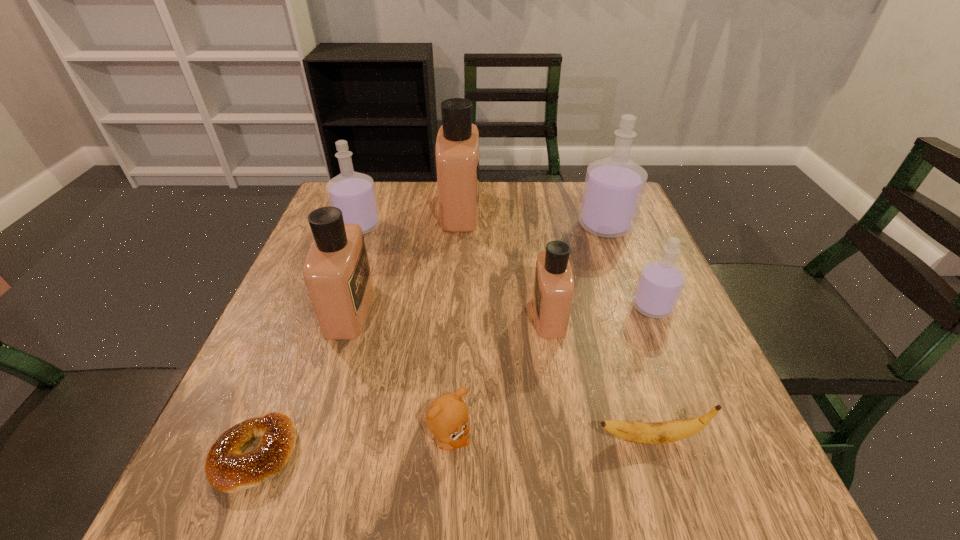
You are a GUI agent. You are given a task and a screenshot of the screen. Output one action in this format:
    pyautogui.click(x=<x>, y=<y>)
    Task: Click on the free space that is in between the second biggest beige perfume and the shortest object
    The width and height of the screenshot is (960, 540).
    Given the screenshot: What is the action you would take?
    (x=302, y=382)

Where is `free point between the fourth perfume from right to left and the second smallest beige perfume`? free point between the fourth perfume from right to left and the second smallest beige perfume is located at coordinates (405, 260).

Identify the location of empty space that is in between the biggest purple perfume and the brown teddy bear. The width and height of the screenshot is (960, 540). (527, 333).

Locate an element on the screen. This screenshot has width=960, height=540. unoccupied area between the seventh tallest object and the biggest beige perfume is located at coordinates (455, 325).

What are the coordinates of `unoccupied area between the second shortest object and the biggest purple perfume` in the screenshot? It's located at click(627, 332).

You are a GUI agent. You are given a task and a screenshot of the screen. Output one action in this format:
    pyautogui.click(x=<x>, y=<y>)
    Task: Click on the free space between the teddy bear and the smallest beige perfume
    The width and height of the screenshot is (960, 540).
    Given the screenshot: What is the action you would take?
    pyautogui.click(x=499, y=377)

At what (x,y) coordinates should I click in order to perform the action: click on object that is the second closest to the nearest purple perfume. Please return your answer as a coordinate pair (x, y). The height and width of the screenshot is (540, 960). Looking at the image, I should click on (614, 186).

What are the coordinates of `object that is the closest one to the brown teddy bear` in the screenshot? It's located at (660, 432).

What are the coordinates of `perfume that is the fifth closest one to the second beige perfume from left to right` in the screenshot? It's located at (660, 283).

Identify which perfume is located as the second nearest to the third shortest object. Please provide its 2D coordinates. Your answer should be formatted as a tuple, i.e. [(x, y)], where the tuple contains the x and y coordinates of a point satisfying the conditions above.

[(336, 271)]